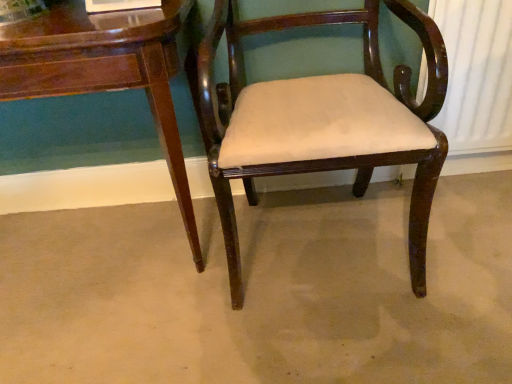
Identify the location of vacant area situated below mahogany wood chair at center (from a real-world perspective). (310, 235).